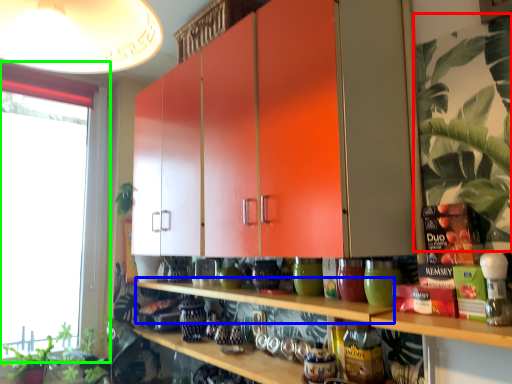
Question: Which is farther away from plant (highlighted by a red box)? shelf (highlighted by a blue box) or window (highlighted by a green box)?

Choices:
 (A) shelf
 (B) window

Answer: (B)